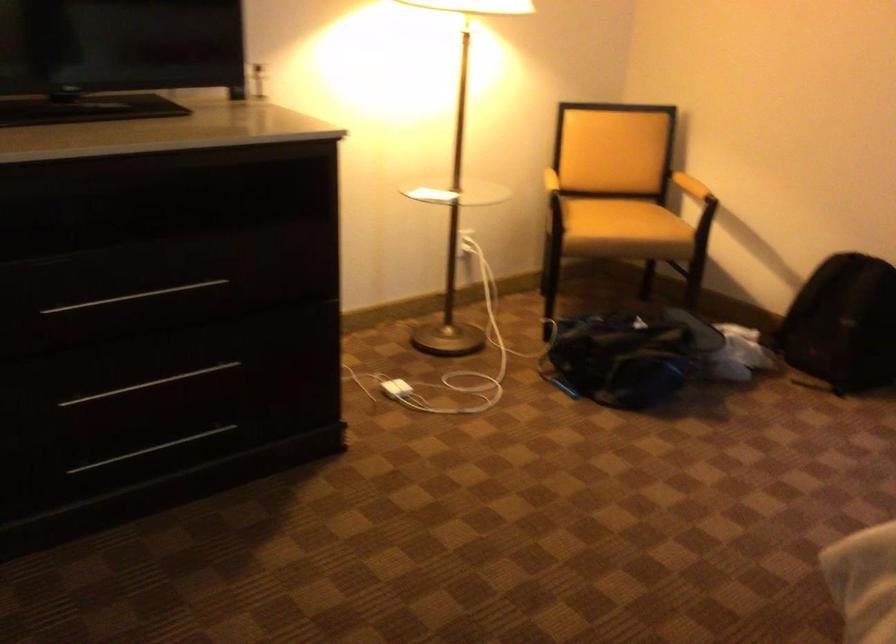
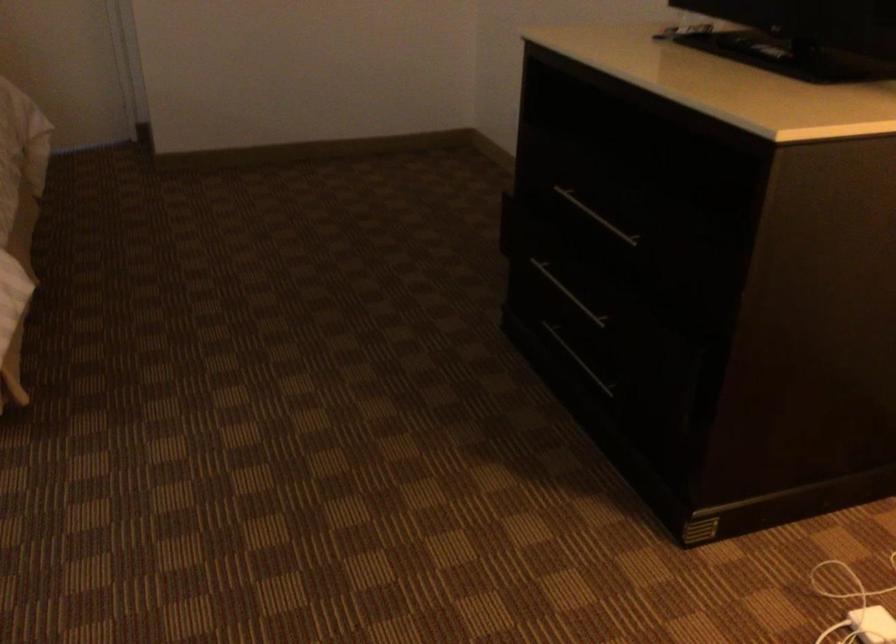
Where in the second image is the point corresponding to [138,389] from the first image?

(567, 292)